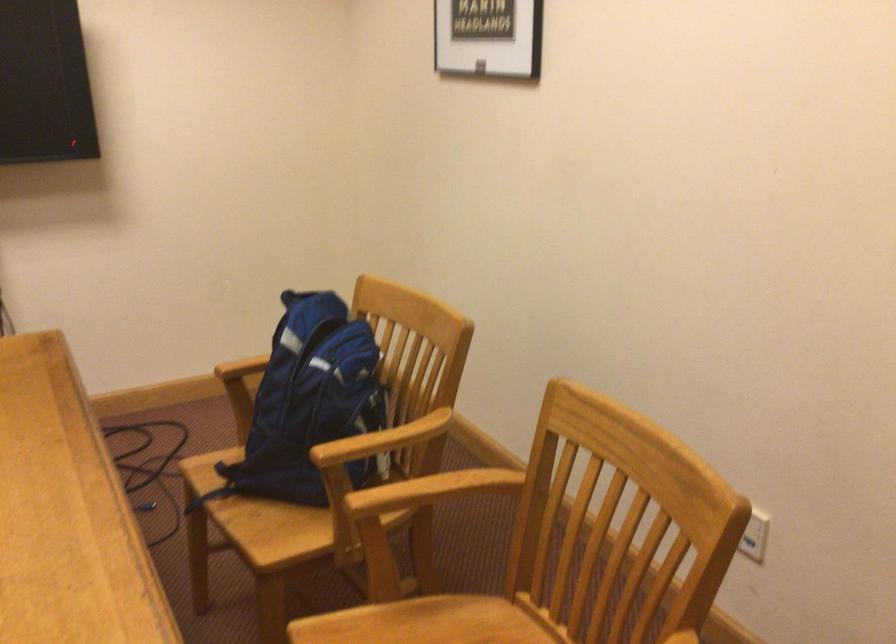
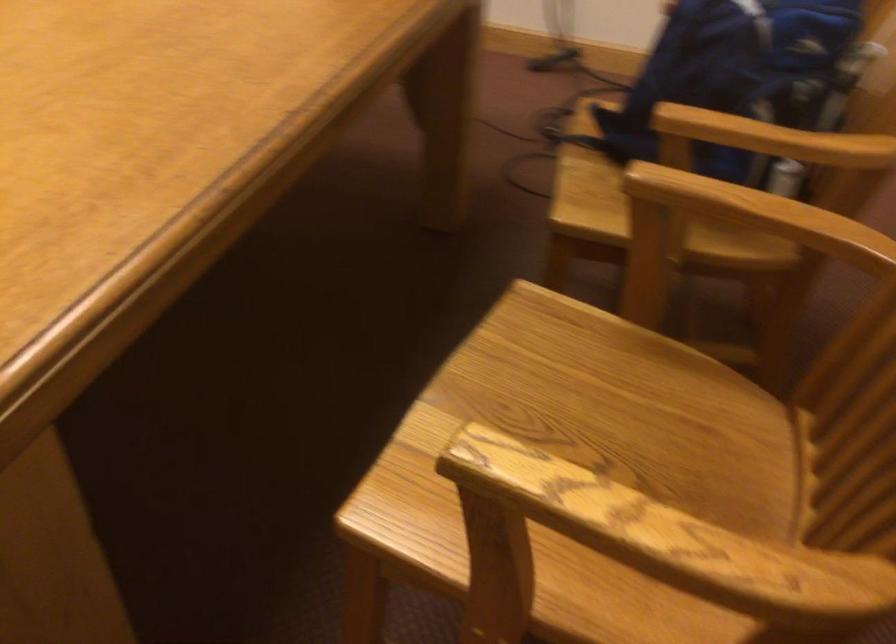
How did the camera likely rotate?

The rotation direction of the camera is left-down.